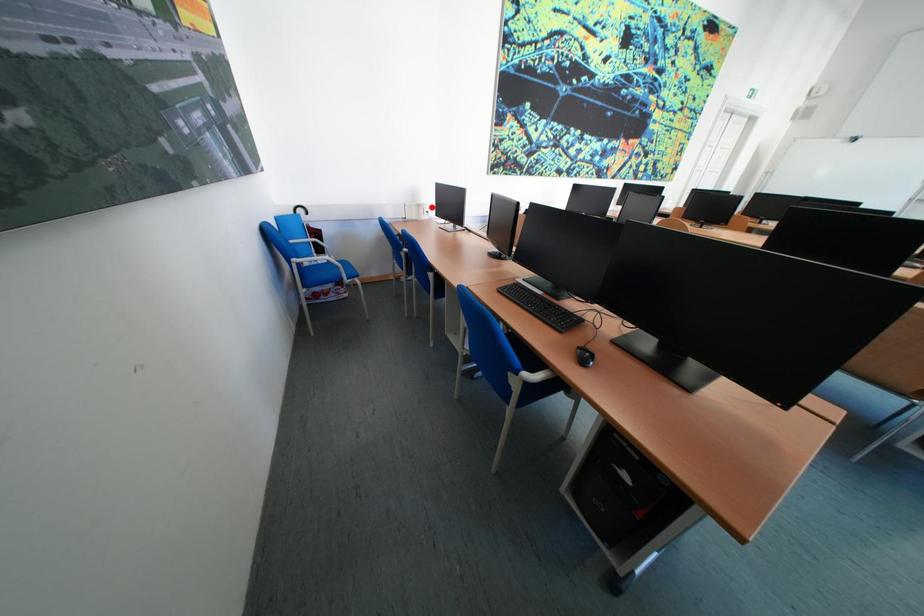
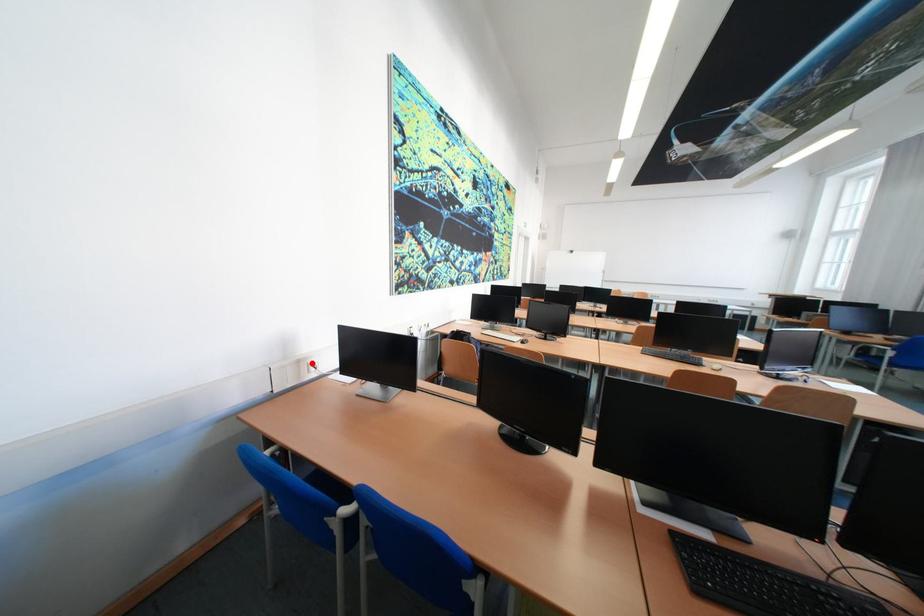
Based on the photo, I am providing you with two images of the same scene from different viewpoints. A red point is marked on the first image and another point is marked on the second image. Are the points marked in image1 and image2 representing the same 3D position?

Yes